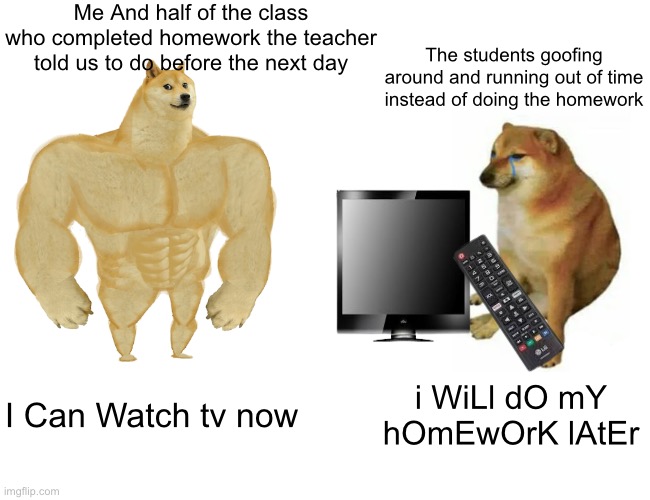
Where is `remote controller`? remote controller is located at coordinates (472, 246).